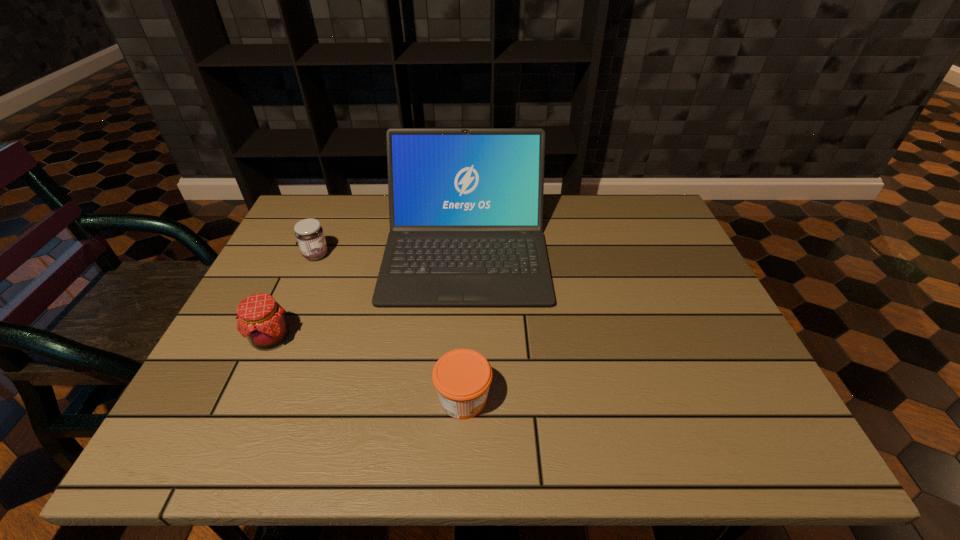
Where is `object present at the near edge`? The image size is (960, 540). object present at the near edge is located at coordinates (462, 377).

The image size is (960, 540). In the image, there is a desktop. Find the location of `vacant space at the far edge`. vacant space at the far edge is located at coordinates (552, 201).

In the image, there is a desktop. Identify the location of free region at the near edge. (581, 414).

You are a GUI agent. You are given a task and a screenshot of the screen. Output one action in this format:
    pyautogui.click(x=<x>, y=<y>)
    Task: Click on the free space at the left edge of the desktop
    
    Given the screenshot: What is the action you would take?
    pyautogui.click(x=287, y=313)

You are a GUI agent. You are given a task and a screenshot of the screen. Output one action in this format:
    pyautogui.click(x=<x>, y=<y>)
    Task: Click on the free spot at the right edge of the desktop
    The height and width of the screenshot is (540, 960).
    Given the screenshot: What is the action you would take?
    650,256

The image size is (960, 540). In order to click on blank space at the near left corner of the desktop in this screenshot , I will do `click(228, 417)`.

The image size is (960, 540). In the image, there is a desktop. Identify the location of free space at the near right corner. (780, 448).

Locate an element on the screen. blank region between the nearest object and the third farthest object is located at coordinates (368, 368).

Where is `free space between the third farthest object and the rightmost jam`? free space between the third farthest object and the rightmost jam is located at coordinates coord(368,368).

Where is `free spot between the laptop computer and the second nearest object`? The width and height of the screenshot is (960, 540). free spot between the laptop computer and the second nearest object is located at coordinates (369, 294).